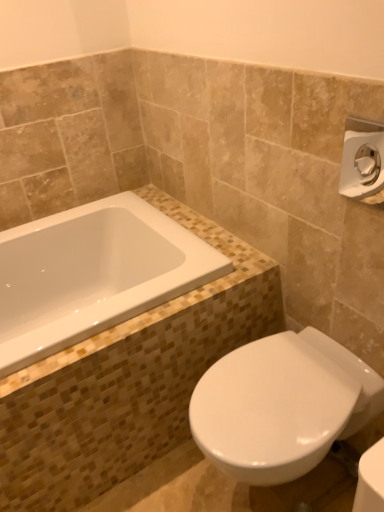
Measure the distance between point (33,284) and camera.

Point (33,284) and camera are 1.82 meters apart from each other.

The image size is (384, 512). What do you see at coordinates (363, 160) in the screenshot?
I see `satin nickel towel bar at upper right` at bounding box center [363, 160].

Find the location of a particular element. Image resolution: width=384 pixels, height=512 pixels. white glossy bathtub at upper left is located at coordinates (92, 274).

The image size is (384, 512). In order to click on bathtub on the left of white glossy toilet at lower right in this screenshot , I will do pyautogui.click(x=92, y=274).

Is white glossy toilet at lower right a part of white glossy bathtub at upper left?

Actually, white glossy toilet at lower right is outside white glossy bathtub at upper left.

Is white glossy bathtub at upper left not close to white glossy toilet at lower right?

They are positioned close to each other.

Does satin nickel towel bar at upper right have a greater height compared to white glossy bathtub at upper left?

Yes.

Considering the positions of point (345, 152) and point (123, 256), is point (345, 152) closer or farther from the camera than point (123, 256)?

Point (345, 152) appears to be closer to the viewer than point (123, 256).

Does satin nickel towel bar at upper right have a larger size compared to white glossy bathtub at upper left?

No, satin nickel towel bar at upper right is not bigger than white glossy bathtub at upper left.

Based on the photo, can you tell me how much satin nickel towel bar at upper right and white glossy bathtub at upper left differ in facing direction?

The angle between the facing direction of satin nickel towel bar at upper right and the facing direction of white glossy bathtub at upper left is 91.9 degrees.

Is white glossy toilet at lower right taller or shorter than white glossy bathtub at upper left?

In the image, white glossy toilet at lower right appears to be taller than white glossy bathtub at upper left.

Which of these two, white glossy toilet at lower right or white glossy bathtub at upper left, is bigger?

white glossy toilet at lower right is bigger.

Does white glossy toilet at lower right have a greater width compared to white glossy bathtub at upper left?

In fact, white glossy toilet at lower right might be narrower than white glossy bathtub at upper left.

Which object is positioned more to the left, white glossy toilet at lower right or white glossy bathtub at upper left?

From the viewer's perspective, white glossy bathtub at upper left appears more on the left side.

Is white glossy bathtub at upper left taller than satin nickel towel bar at upper right?

No, white glossy bathtub at upper left is not taller than satin nickel towel bar at upper right.

From the picture: How many degrees apart are the facing directions of white glossy bathtub at upper left and satin nickel towel bar at upper right?

The facing directions of white glossy bathtub at upper left and satin nickel towel bar at upper right are 91.9 degrees apart.

In the image, is white glossy bathtub at upper left positioned in front of or behind satin nickel towel bar at upper right?

white glossy bathtub at upper left is behind satin nickel towel bar at upper right.

Is white glossy toilet at lower right outside of satin nickel towel bar at upper right?

Yes.

Is white glossy toilet at lower right not near satin nickel towel bar at upper right?

white glossy toilet at lower right is near satin nickel towel bar at upper right, not far away.

This screenshot has height=512, width=384. Identify the location of towel bar that appears in front of the white glossy toilet at lower right. (363, 160).

Is satin nickel towel bar at upper right at the left side of white glossy toilet at lower right?

In fact, satin nickel towel bar at upper right is to the right of white glossy toilet at lower right.

Which object is more forward, satin nickel towel bar at upper right or white glossy toilet at lower right?

Positioned in front is satin nickel towel bar at upper right.

Where is `towel bar located in front of the white glossy toilet at lower right`? This screenshot has width=384, height=512. towel bar located in front of the white glossy toilet at lower right is located at coordinates (363, 160).

From a real-world perspective, is satin nickel towel bar at upper right beneath white glossy toilet at lower right?

No.

Where is `toilet below the white glossy bathtub at upper left (from the image's perspective)`? This screenshot has width=384, height=512. toilet below the white glossy bathtub at upper left (from the image's perspective) is located at coordinates (281, 405).

This screenshot has height=512, width=384. Find the location of `towel bar that is on the right side of white glossy bathtub at upper left`. towel bar that is on the right side of white glossy bathtub at upper left is located at coordinates (363, 160).

Estimate the real-world distances between objects in this image. Which object is further from white glossy bathtub at upper left, satin nickel towel bar at upper right or white glossy toilet at lower right?

satin nickel towel bar at upper right lies further to white glossy bathtub at upper left than the other object.

Looking at this image, which object lies nearer to the anchor point white glossy bathtub at upper left, white glossy toilet at lower right or satin nickel towel bar at upper right?

Among the two, white glossy toilet at lower right is located nearer to white glossy bathtub at upper left.

Looking at the image, which one is located closer to white glossy toilet at lower right, white glossy bathtub at upper left or satin nickel towel bar at upper right?

Among the two, white glossy bathtub at upper left is located nearer to white glossy toilet at lower right.

Estimate the real-world distances between objects in this image. Which object is closer to satin nickel towel bar at upper right, white glossy bathtub at upper left or white glossy toilet at lower right?

white glossy toilet at lower right.

Which object lies further to the anchor point white glossy toilet at lower right, satin nickel towel bar at upper right or white glossy bathtub at upper left?

Based on the image, satin nickel towel bar at upper right appears to be further to white glossy toilet at lower right.

Considering their positions, is white glossy toilet at lower right positioned further to satin nickel towel bar at upper right than white glossy bathtub at upper left?

Among the two, white glossy bathtub at upper left is located further to satin nickel towel bar at upper right.

Locate an element on the screen. Image resolution: width=384 pixels, height=512 pixels. bathtub between satin nickel towel bar at upper right and white glossy toilet at lower right in the vertical direction is located at coordinates (92, 274).